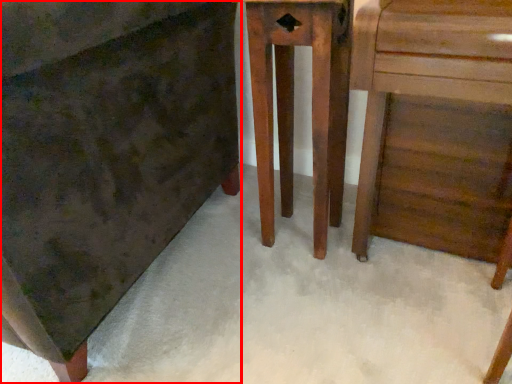
Question: From the image's perspective, what is the correct spatial relationship of chest of drawers (annotated by the red box) in relation to furniture?

Choices:
 (A) below
 (B) above

Answer: (B)